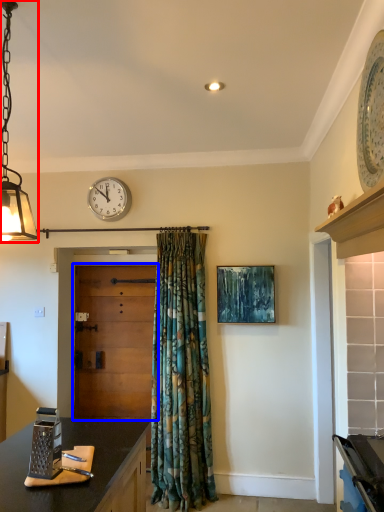
Question: Which of the following is the closest to the observer, lamp (highlighted by a red box) or door (highlighted by a blue box)?

Choices:
 (A) lamp
 (B) door

Answer: (A)